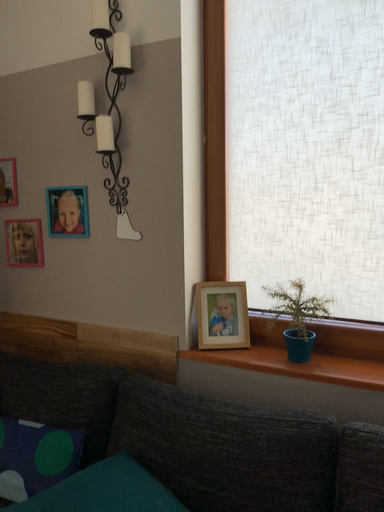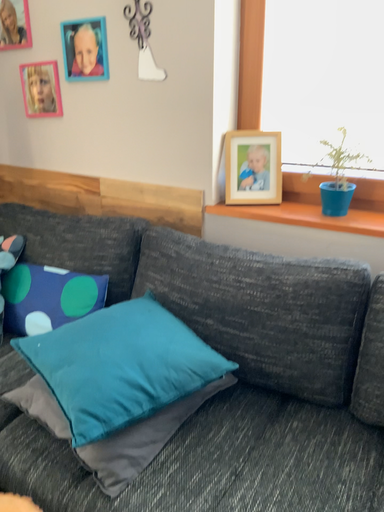
Question: Which way did the camera rotate in the video?

Choices:
 (A) rotated downward
 (B) rotated upward

Answer: (A)